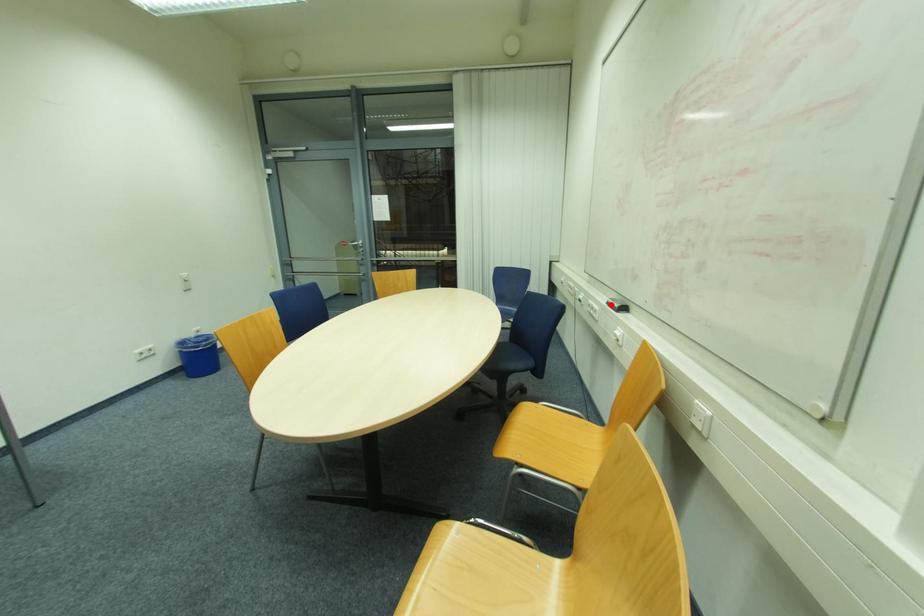
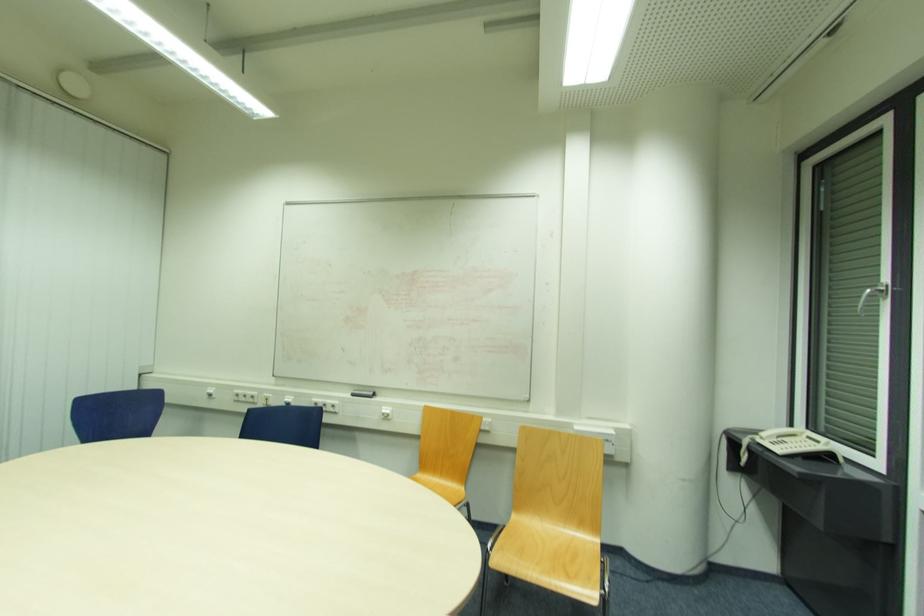
Question: I am providing you with two images of the same scene from different viewpoints. In image1, a red point is highlighted. Considering the same 3D point in image2, which of the following is correct?

Choices:
 (A) It is closer
 (B) It is farther

Answer: (B)